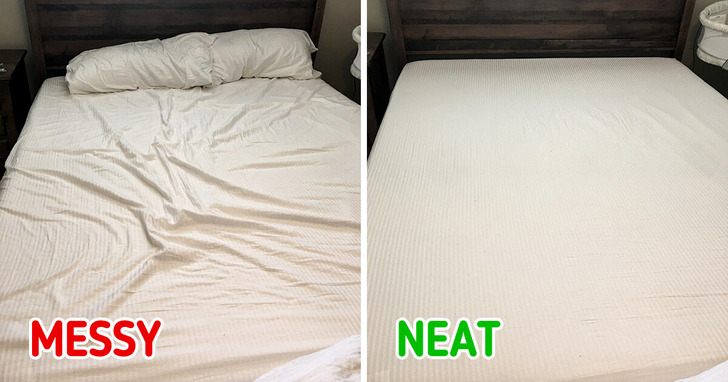
Identify the location of headboard. This screenshot has width=728, height=382. (482, 43), (150, 26).